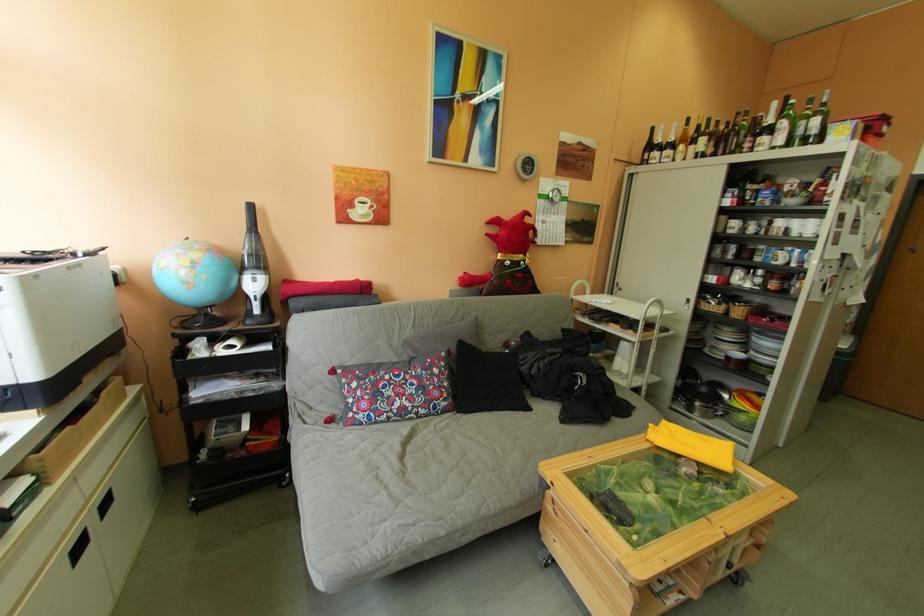
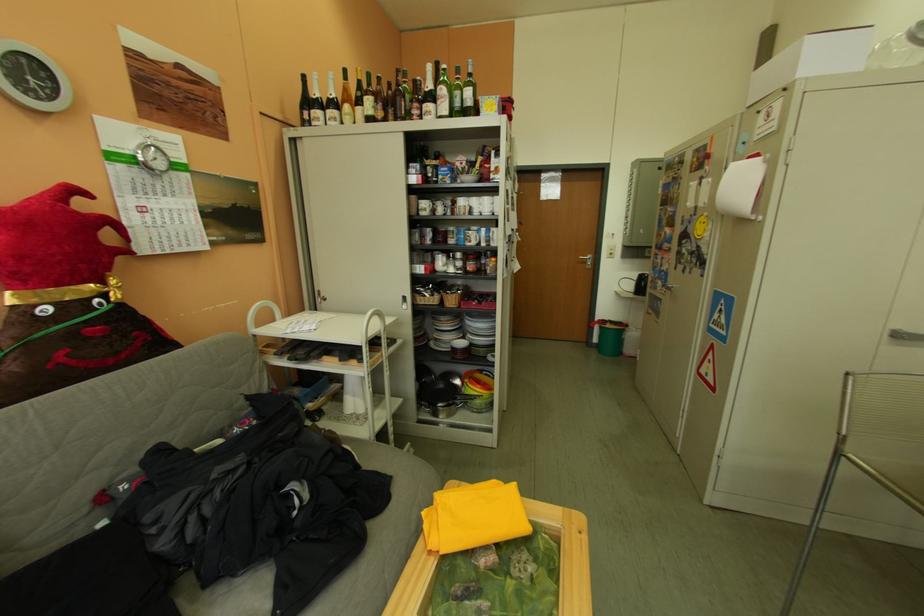
Question: The camera is either moving clockwise (left) or counter-clockwise (right) around the object. The first image is from the beginning of the video and the second image is from the end. Is the camera moving left or right when shooting the video?

Choices:
 (A) Left
 (B) Right

Answer: (A)